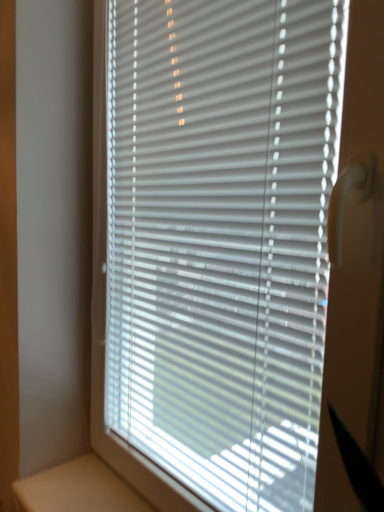
Describe the element at coordinates (215, 242) in the screenshot. I see `white plastic blinds at center` at that location.

Locate an element on the screen. The width and height of the screenshot is (384, 512). white plastic blinds at center is located at coordinates (215, 242).

Locate an element on the screen. white plastic blinds at center is located at coordinates (215, 242).